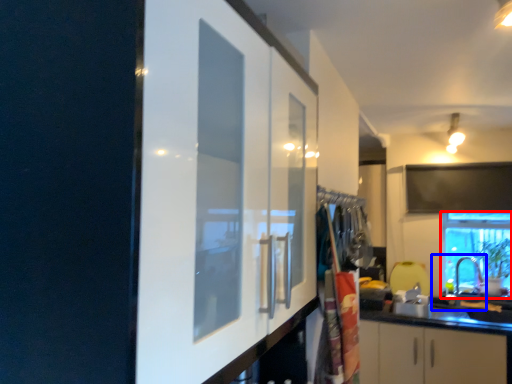
Question: Which point is closer to the camera, window (highlighted by a red box) or sink (highlighted by a blue box)?

Choices:
 (A) window
 (B) sink

Answer: (B)